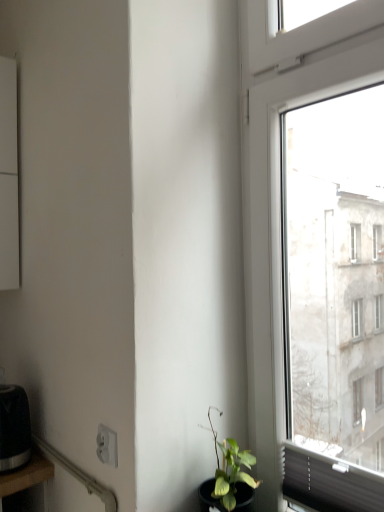
What do you see at coordinates (14, 428) in the screenshot?
I see `black matte toaster at lower left` at bounding box center [14, 428].

The width and height of the screenshot is (384, 512). What do you see at coordinates (27, 475) in the screenshot?
I see `black wood table at lower left` at bounding box center [27, 475].

Locate an element on the screen. black matte toaster at lower left is located at coordinates (14, 428).

Can you confirm if black wood table at lower left is smaller than white plastic power plugs and sockets at lower left?

Actually, black wood table at lower left might be larger than white plastic power plugs and sockets at lower left.

Is black wood table at lower left aimed at white plastic power plugs and sockets at lower left?

Yes, black wood table at lower left is facing white plastic power plugs and sockets at lower left.

Is black wood table at lower left to the left of white plastic power plugs and sockets at lower left from the viewer's perspective?

Yes.

How far apart are black wood table at lower left and white plastic power plugs and sockets at lower left?

black wood table at lower left is 16.19 inches away from white plastic power plugs and sockets at lower left.

Which is behind, point (25, 455) or point (12, 488)?

The point (25, 455) is behind.

Does black matte toaster at lower left have a lesser width compared to black wood table at lower left?

Indeed, black matte toaster at lower left has a lesser width compared to black wood table at lower left.

Considering the positions of objects black matte toaster at lower left and black wood table at lower left in the image provided, who is in front, black matte toaster at lower left or black wood table at lower left?

Positioned in front is black wood table at lower left.

Is black matte toaster at lower left far from black wood table at lower left?

No, there isn't a large distance between black matte toaster at lower left and black wood table at lower left.

From a real-world perspective, which is physically below, white plastic power plugs and sockets at lower left or black matte toaster at lower left?

black matte toaster at lower left.

Can you confirm if white plastic power plugs and sockets at lower left is positioned to the left of black matte toaster at lower left?

No.

Is white plastic power plugs and sockets at lower left spatially inside black matte toaster at lower left, or outside of it?

white plastic power plugs and sockets at lower left exists outside the volume of black matte toaster at lower left.

From the image's perspective, who appears lower, black wood table at lower left or black matte toaster at lower left?

black wood table at lower left, from the image's perspective.

Looking at this image, which is in front, black wood table at lower left or black matte toaster at lower left?

black wood table at lower left is in front.

Would you consider black wood table at lower left to be distant from black matte toaster at lower left?

They are positioned close to each other.

Is black matte toaster at lower left in front of or behind white plastic power plugs and sockets at lower left in the image?

black matte toaster at lower left is behind white plastic power plugs and sockets at lower left.

Based on their sizes in the image, would you say black matte toaster at lower left is bigger or smaller than white plastic power plugs and sockets at lower left?

Clearly, black matte toaster at lower left is larger in size than white plastic power plugs and sockets at lower left.

In terms of width, does black matte toaster at lower left look wider or thinner when compared to white plastic power plugs and sockets at lower left?

Considering their sizes, black matte toaster at lower left looks broader than white plastic power plugs and sockets at lower left.

Is black matte toaster at lower left at the right side of white plastic power plugs and sockets at lower left?

Incorrect, black matte toaster at lower left is not on the right side of white plastic power plugs and sockets at lower left.

Is white plastic power plugs and sockets at lower left with black wood table at lower left?

white plastic power plugs and sockets at lower left and black wood table at lower left are clearly separated.

Considering the sizes of objects white plastic power plugs and sockets at lower left and black wood table at lower left in the image provided, who is smaller, white plastic power plugs and sockets at lower left or black wood table at lower left?

Smaller between the two is white plastic power plugs and sockets at lower left.

Is white plastic power plugs and sockets at lower left looking in the opposite direction of black wood table at lower left?

That's not correct — white plastic power plugs and sockets at lower left is not looking away from black wood table at lower left.

Between white plastic power plugs and sockets at lower left and black wood table at lower left, which one is positioned behind?

black wood table at lower left is more distant.

Where is `power plugs and sockets that is on the right side of black wood table at lower left`? This screenshot has height=512, width=384. power plugs and sockets that is on the right side of black wood table at lower left is located at coordinates (107, 445).

This screenshot has width=384, height=512. Identify the location of table below the black matte toaster at lower left (from the image's perspective). (27, 475).

From the image, which object appears to be nearer to black matte toaster at lower left, black wood table at lower left or white plastic power plugs and sockets at lower left?

Based on the image, black wood table at lower left appears to be nearer to black matte toaster at lower left.

Which object lies nearer to the anchor point black matte toaster at lower left, white plastic power plugs and sockets at lower left or black wood table at lower left?

black wood table at lower left lies closer to black matte toaster at lower left than the other object.

From the image, which object appears to be farther from black wood table at lower left, black matte toaster at lower left or white plastic power plugs and sockets at lower left?

Based on the image, white plastic power plugs and sockets at lower left appears to be further to black wood table at lower left.

Which object lies nearer to the anchor point white plastic power plugs and sockets at lower left, black wood table at lower left or black matte toaster at lower left?

Based on the image, black wood table at lower left appears to be nearer to white plastic power plugs and sockets at lower left.

Looking at the image, which one is located closer to white plastic power plugs and sockets at lower left, black matte toaster at lower left or black wood table at lower left?

black wood table at lower left.

Considering their positions, is white plastic power plugs and sockets at lower left positioned further to black wood table at lower left than black matte toaster at lower left?

white plastic power plugs and sockets at lower left is further to black wood table at lower left.

I want to click on appliance between black wood table at lower left and white plastic power plugs and sockets at lower left in the horizontal direction, so click(14, 428).